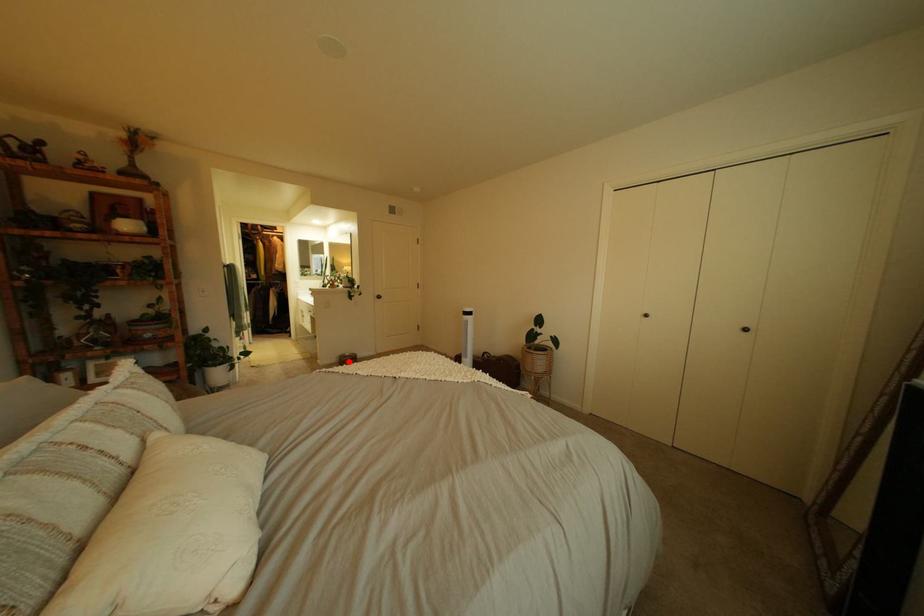
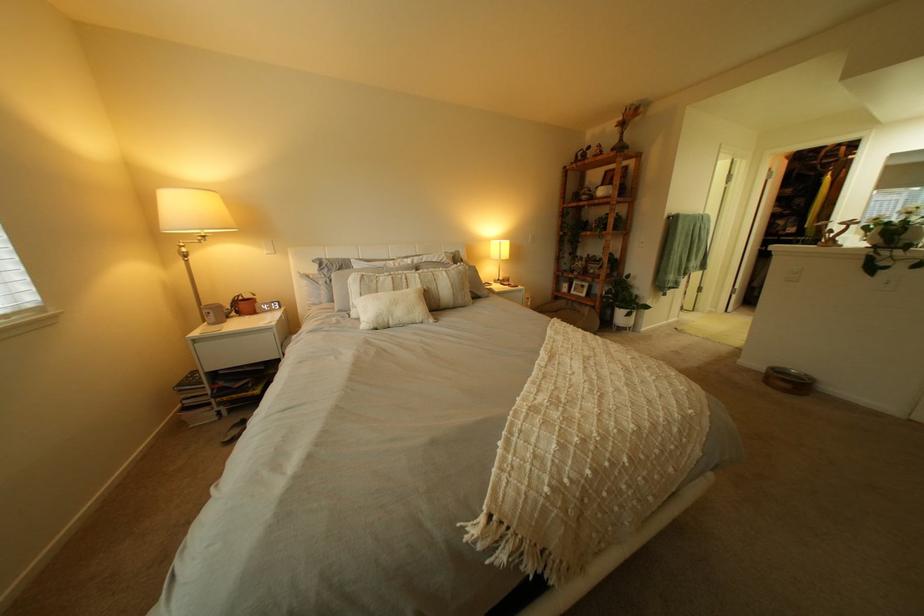
Question: I am providing you with two images of the same scene from different viewpoints. In image1, a red point is highlighted. Considering the same 3D point in image2, which of the following is correct?

Choices:
 (A) It is closer
 (B) It is farther

Answer: (B)